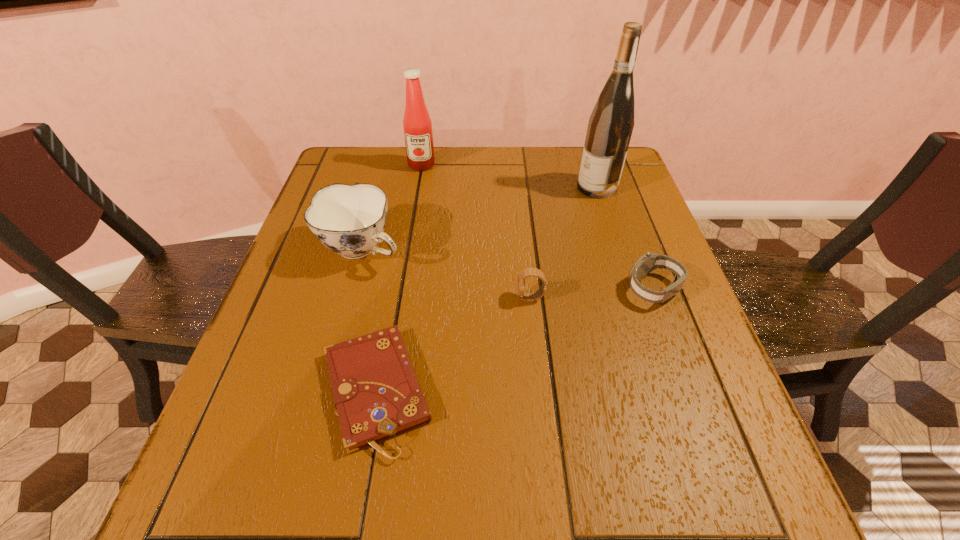
The height and width of the screenshot is (540, 960). I want to click on wine bottle, so click(x=610, y=126).

I want to click on the tallest object, so click(x=610, y=126).

Find the location of a particular element. The height and width of the screenshot is (540, 960). the farthest object is located at coordinates (417, 124).

You are a GUI agent. You are given a task and a screenshot of the screen. Output one action in this format:
    pyautogui.click(x=<x>, y=<y>)
    Task: Click on the fifth shortest object
    This screenshot has height=540, width=960.
    Given the screenshot: What is the action you would take?
    pyautogui.click(x=417, y=124)

Locate an element on the screen. Image resolution: width=960 pixels, height=540 pixels. the third tallest object is located at coordinates (348, 219).

You are a GUI agent. You are given a task and a screenshot of the screen. Output one action in this format:
    pyautogui.click(x=<x>, y=<y>)
    Task: Click on the left watch
    The image size is (960, 540).
    Given the screenshot: What is the action you would take?
    pyautogui.click(x=527, y=297)

I want to click on the right watch, so click(649, 261).

I want to click on the shortest object, so click(376, 393).

Locate an element on the screen. notebook is located at coordinates (376, 393).

Image resolution: width=960 pixels, height=540 pixels. I want to click on vacant space located 0.110m on the back of the tallest object, so click(x=588, y=156).